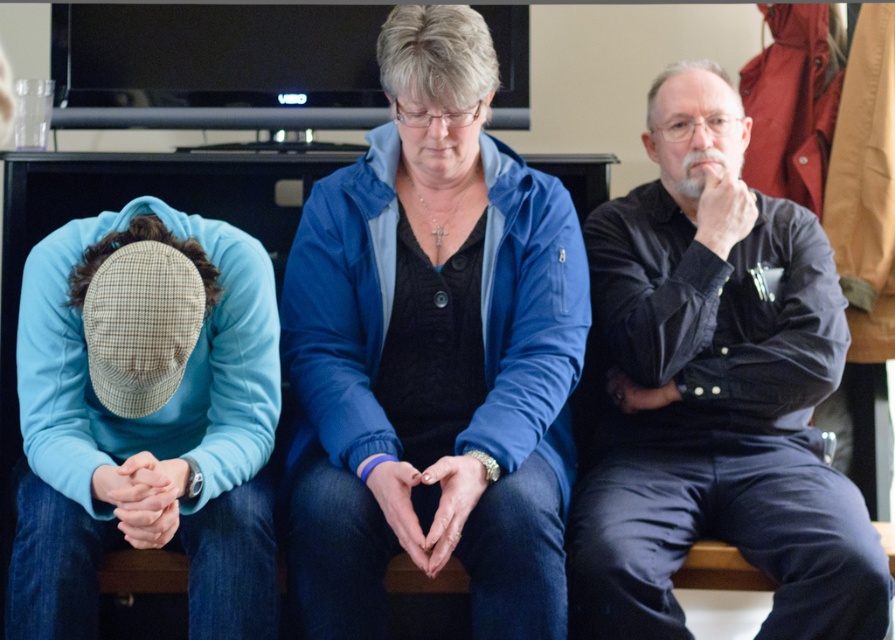
Who is taller, black denim shirt at right or light blue fleece at left?

black denim shirt at right

Which is more to the left, black denim shirt at right or light blue fleece at left?

light blue fleece at left is more to the left.

Is point (603, 522) less distant than point (154, 326)?

No.

This screenshot has width=895, height=640. Identify the location of black denim shirt at right. (714, 392).

Between point (450, 529) and point (678, 454), which one is positioned in front?

Point (450, 529)

Can you confirm if blue fabric jacket at center is taller than black denim shirt at right?

In fact, blue fabric jacket at center may be shorter than black denim shirt at right.

This screenshot has width=895, height=640. Describe the element at coordinates (433, 353) in the screenshot. I see `blue fabric jacket at center` at that location.

Where is `blue fabric jacket at center`? This screenshot has width=895, height=640. blue fabric jacket at center is located at coordinates (433, 353).

Identify the location of blue fabric jacket at center. (433, 353).

Between blue fabric jacket at center and light blue fleece at left, which one is positioned lower?

Positioned lower is light blue fleece at left.

Locate an element on the screen. The image size is (895, 640). blue fabric jacket at center is located at coordinates (433, 353).